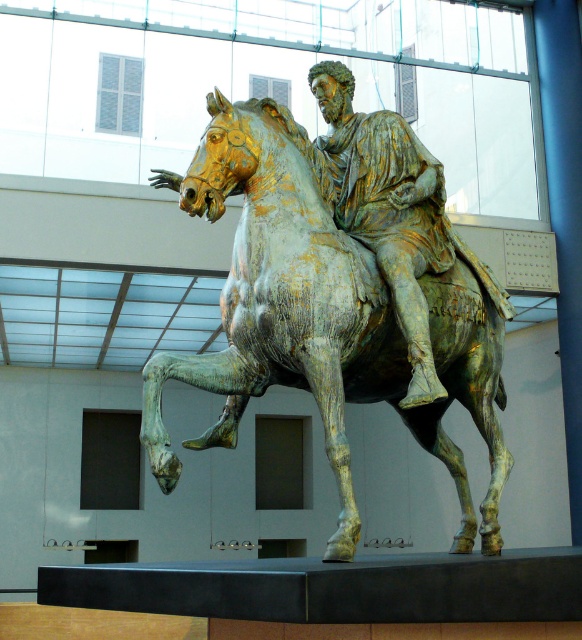
Does gold patina bronze horse and rider at center have a greater height compared to gold/gilded bronze rider at center?

Yes, gold patina bronze horse and rider at center is taller than gold/gilded bronze rider at center.

Between gold patina bronze horse and rider at center and gold/gilded bronze rider at center, which one has less height?

With less height is gold/gilded bronze rider at center.

Is point (327, 352) positioned behind point (331, 106)?

No, it is not.

Identify the location of gold patina bronze horse and rider at center. Image resolution: width=582 pixels, height=640 pixels. (340, 291).